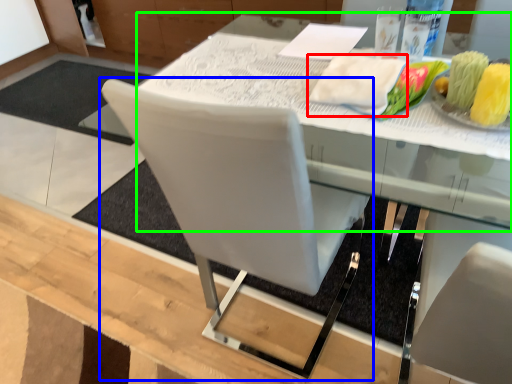
Question: Which is nearer to the cloth (highlighted by a red box)? chair (highlighted by a blue box) or round table (highlighted by a green box).

Choices:
 (A) chair
 (B) round table

Answer: (B)